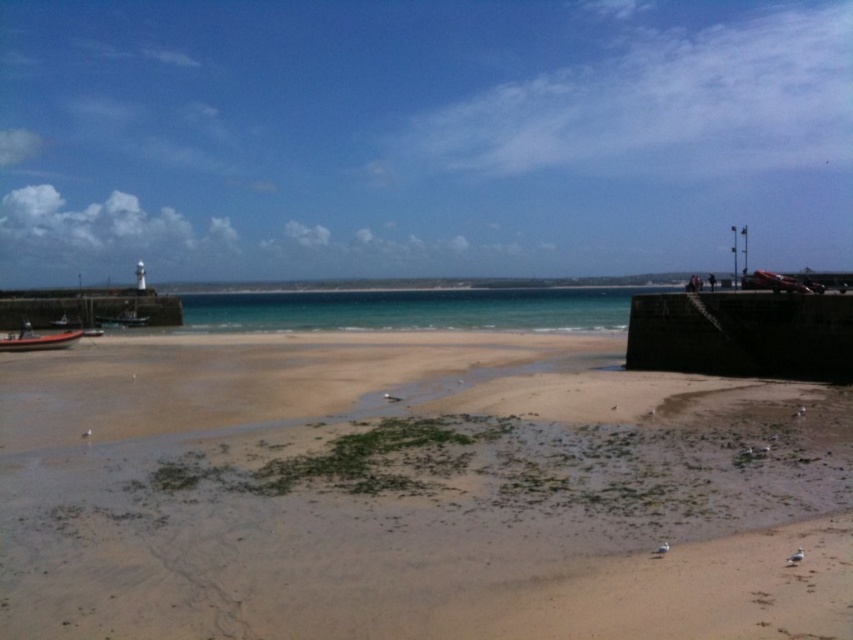
You are a photographer setting up equipment on the brown sandy beach at lower center. You notice the orange fiberglass boat at lower left nearby. From your position on the beach, in which direction should you move to get a better view of the boat?

You should move to the right because the brown sandy beach at lower center is positioned under the orange fiberglass boat at lower left, meaning the boat is to the left and slightly above your current position. Moving right might bring you closer or into a better angle.

You are standing on the brown sandy beach at lower center and want to walk to the orange fiberglass boat at lower left. Which direction should you head?

You should head to the left because the brown sandy beach at lower center is to the right of the orange fiberglass boat at lower left, meaning the boat is to your left.

You are a photographer planning to capture the brown sandy beach at lower center and the orange fiberglass boat at lower left in a single frame. Based on their heights, which object will appear larger in the photo?

The orange fiberglass boat at lower left will appear larger in the photo because it is taller than the brown sandy beach at lower center.